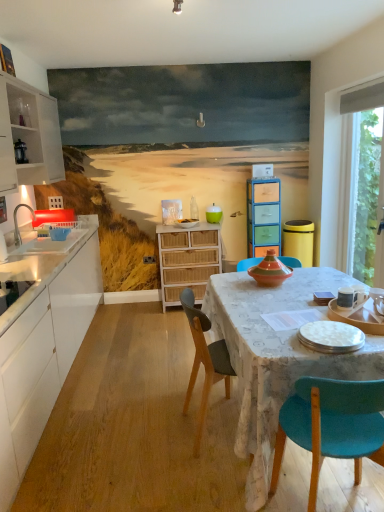
At what (x,y) coordinates should I click in order to perform the action: click on space that is in front of wooden chair at center, which ranks as the second chair in right-to-left order. Please return your answer as a coordinate pair (x, y). Image resolution: width=384 pixels, height=512 pixels. Looking at the image, I should click on (201, 482).